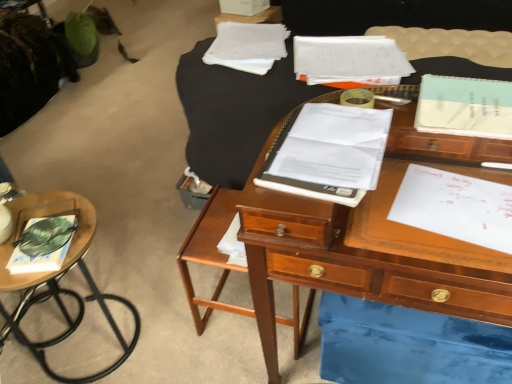
This screenshot has width=512, height=384. Find the location of `vacant space situated above white paper at right (from a real-world perspective)`. vacant space situated above white paper at right (from a real-world perspective) is located at coordinates (456, 200).